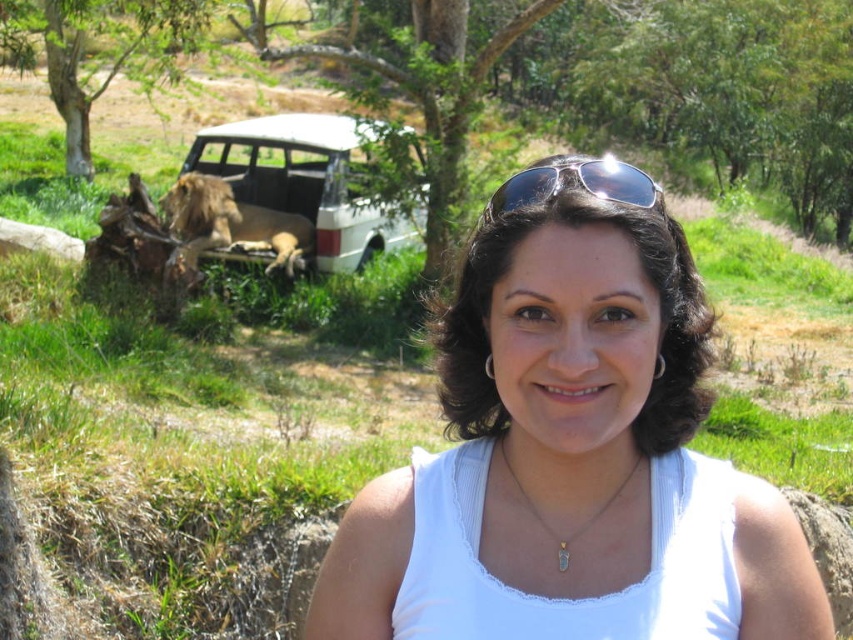
You are a photographer trying to capture the green leafy tree at upper left in the image. Based on its 2D coordinates, where should you position your camera to ensure it is centered in the frame?

To center the green leafy tree at upper left in the frame, position your camera so that the center of the viewfinder aligns with the coordinates point (x=97, y=51).

You are a photographer trying to capture a closeup of the sunglasses at center and the gold chain at center. If your camera can only focus on one object at a time, which object should you adjust the focus for first to ensure the larger object is sharp?

The sunglasses at center has a greater width than the gold chain at center, so you should focus on the sunglasses at center first to ensure the larger object is sharp.